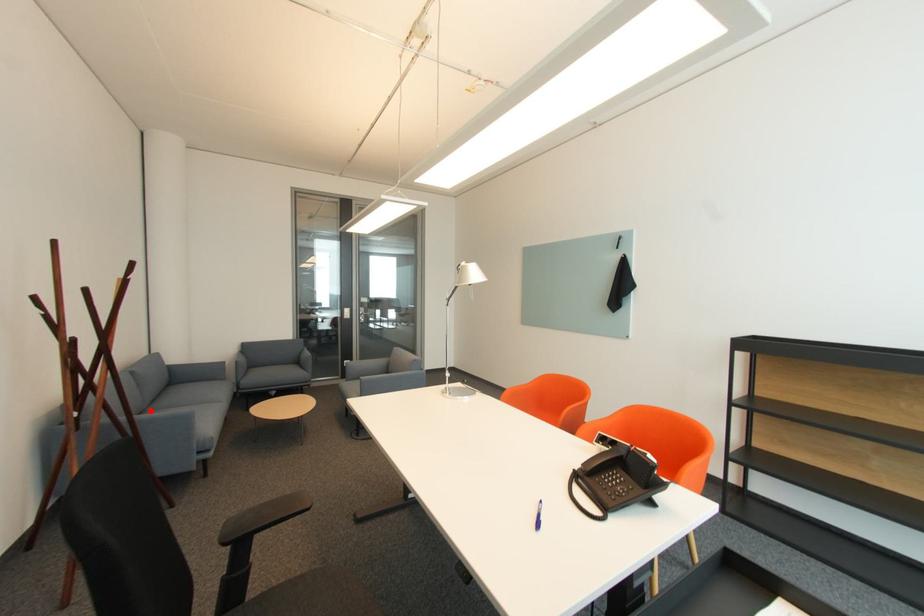
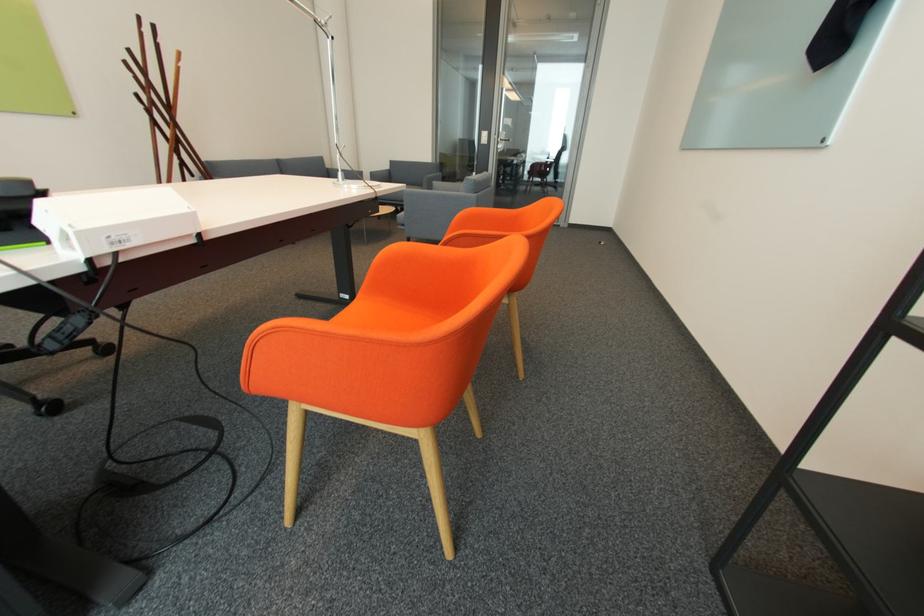
Question: I am providing you with two images of the same scene from different viewpoints. A red point is marked on the first image. Can you still see the location of the red point in image 2?

Choices:
 (A) Yes
 (B) No

Answer: (B)